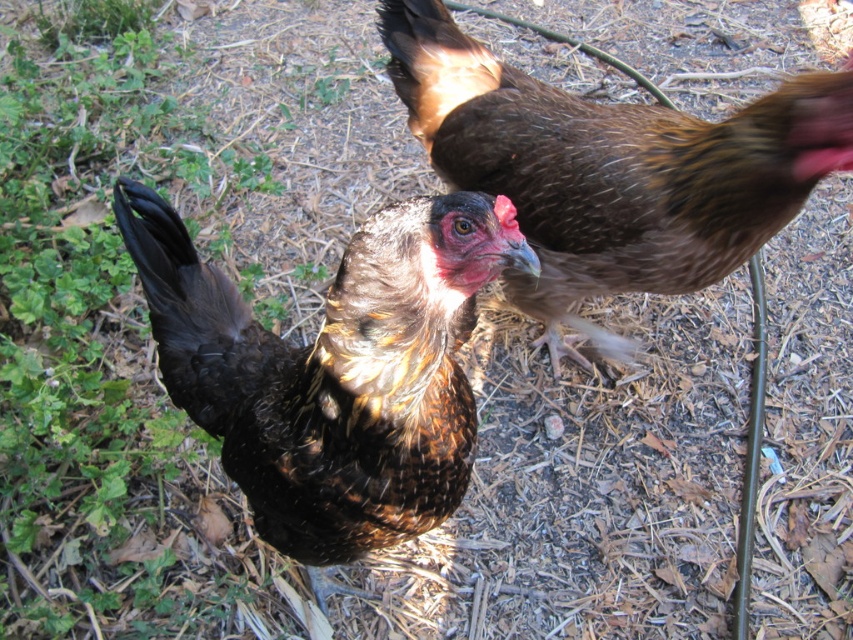
Question: Observing the image, what is the correct spatial positioning of brown speckled feathered chicken at center in reference to brown speckled feather at upper right?

Choices:
 (A) above
 (B) below

Answer: (B)

Question: Where is brown speckled feathered chicken at center located in relation to brown speckled feather at upper right in the image?

Choices:
 (A) above
 (B) below

Answer: (B)

Question: Can you confirm if brown speckled feathered chicken at center is positioned to the left of brown speckled feather at upper right?

Choices:
 (A) no
 (B) yes

Answer: (B)

Question: Which of the following is the closest to the observer?

Choices:
 (A) brown speckled feather at upper right
 (B) brown speckled feathered chicken at center

Answer: (B)

Question: Which object appears closest to the camera in this image?

Choices:
 (A) brown speckled feather at upper right
 (B) brown speckled feathered chicken at center

Answer: (B)